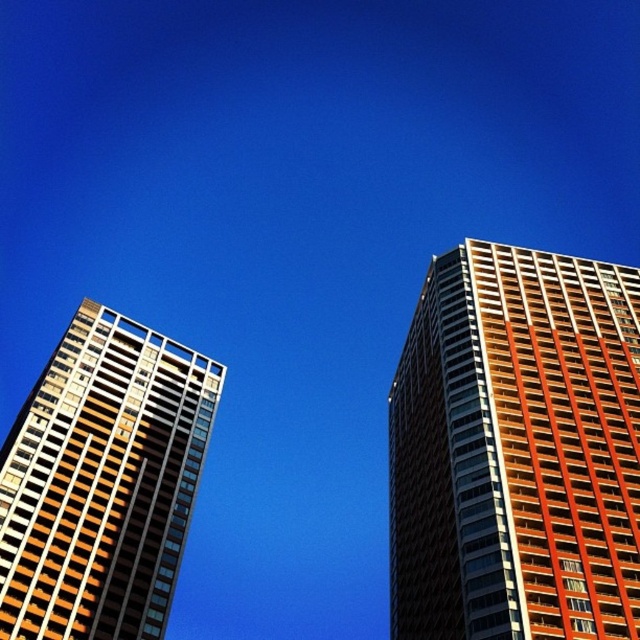
Question: Can you confirm if orange glass building at right is bigger than matte glass building at left?

Choices:
 (A) yes
 (B) no

Answer: (A)

Question: Can you confirm if orange glass building at right is positioned above matte glass building at left?

Choices:
 (A) yes
 (B) no

Answer: (B)

Question: Which point is closer to the camera taking this photo?

Choices:
 (A) (540, 596)
 (B) (104, 588)

Answer: (A)

Question: Does orange glass building at right have a larger size compared to matte glass building at left?

Choices:
 (A) yes
 (B) no

Answer: (A)